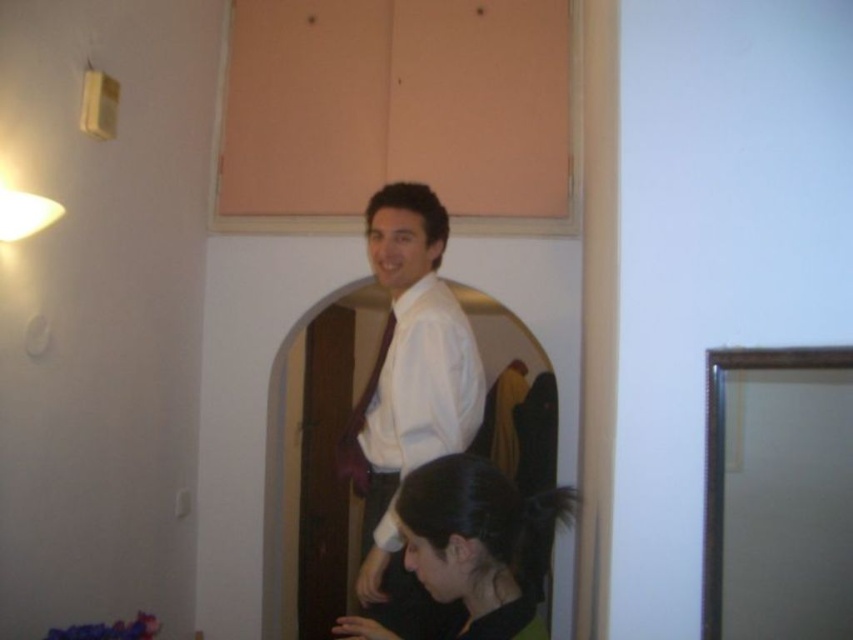
Is black matte hair at center above matte brown tie at center?

Actually, black matte hair at center is below matte brown tie at center.

Based on the photo, who is more distant from viewer, (450, 524) or (384, 342)?

Positioned behind is point (384, 342).

I want to click on black matte hair at center, so pos(474,540).

Identify the location of black matte hair at center. The height and width of the screenshot is (640, 853). (474, 540).

Who is more forward, (392, 310) or (498, 545)?

Positioned in front is point (498, 545).

Does white glossy shirt at center have a greater height compared to black matte hair at center?

Yes.

Between point (393, 442) and point (358, 632), which one is positioned in front?

Point (358, 632) is in front.

Locate an element on the screen. The height and width of the screenshot is (640, 853). white glossy shirt at center is located at coordinates (407, 388).

Does white glossy shirt at center appear on the left side of matte brown tie at center?

In fact, white glossy shirt at center is to the right of matte brown tie at center.

Which is behind, point (381, 403) or point (380, 342)?

Positioned behind is point (380, 342).

Where is `white glossy shirt at center`? Image resolution: width=853 pixels, height=640 pixels. white glossy shirt at center is located at coordinates (407, 388).